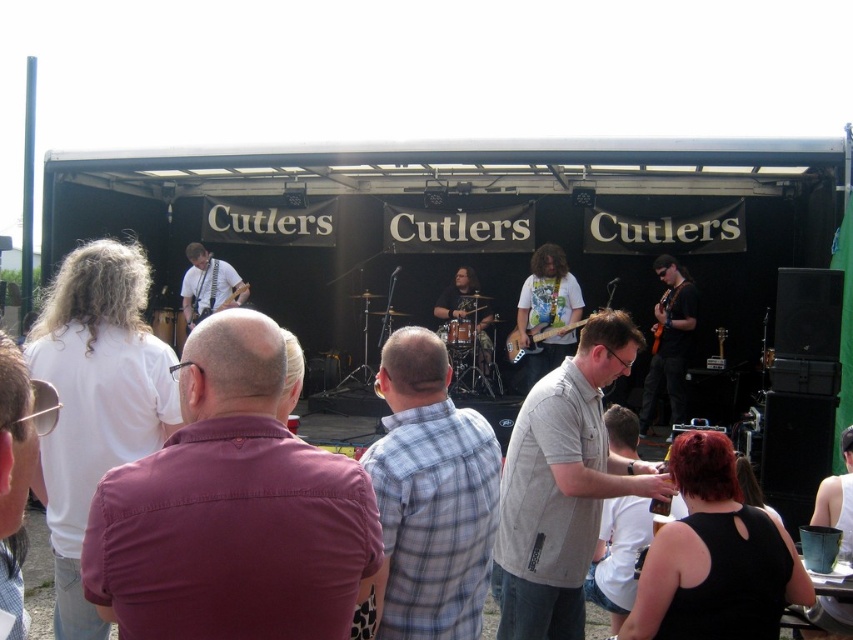
Question: Which point is closer to the camera?

Choices:
 (A) (479, 596)
 (B) (323, 452)

Answer: (B)

Question: Is plaid shirt at center positioned before white t-shirt with graphic print at center?

Choices:
 (A) yes
 (B) no

Answer: (A)

Question: Which point is closer to the camera?

Choices:
 (A) (473, 300)
 (B) (561, 269)

Answer: (B)

Question: Can you confirm if plaid shirt at center is wider than matte black drum set at center?

Choices:
 (A) yes
 (B) no

Answer: (B)

Question: Which point is closer to the camera?

Choices:
 (A) (550, 310)
 (B) (561, 536)
 (C) (608, 577)

Answer: (B)

Question: Considering the relative positions of plaid shirt at center and white t-shirt with graphic print at center in the image provided, where is plaid shirt at center located with respect to white t-shirt with graphic print at center?

Choices:
 (A) above
 (B) below

Answer: (B)